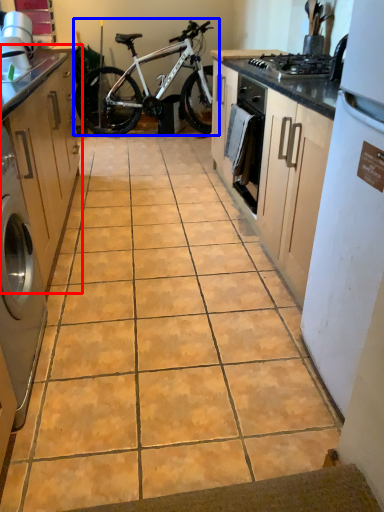
Question: Which of the following is the closest to the observer, cabinetry (highlighted by a red box) or bicycle (highlighted by a blue box)?

Choices:
 (A) cabinetry
 (B) bicycle

Answer: (A)